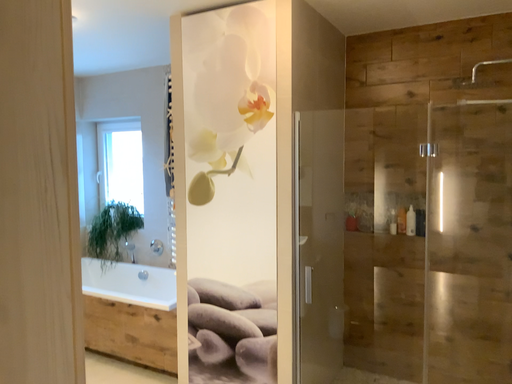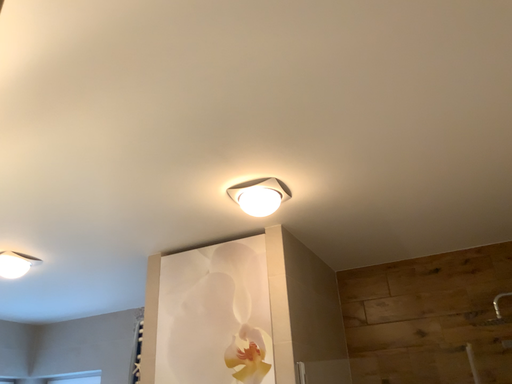
Question: How did the camera likely rotate when shooting the video?

Choices:
 (A) rotated upward
 (B) rotated downward

Answer: (A)